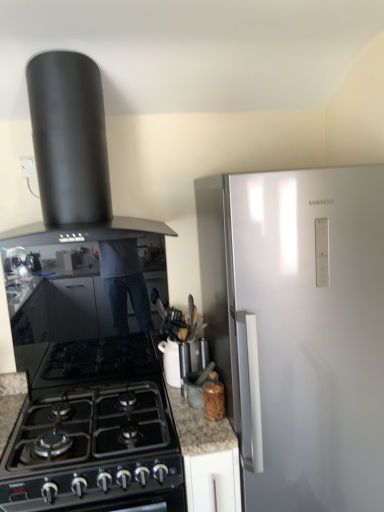
Question: From the image's perspective, is black matte chimney hood at upper left, arranged as the 1th kitchen appliance when viewed from the top, located beneath white glossy teapot at center, which ranks as the 2th kitchen appliance in left-to-right order?

Choices:
 (A) no
 (B) yes

Answer: (A)

Question: From a real-world perspective, does black matte chimney hood at upper left, marked as the 3th kitchen appliance in a bottom-to-top arrangement, stand above white glossy teapot at center, the 2th kitchen appliance in the right-to-left sequence?

Choices:
 (A) yes
 (B) no

Answer: (A)

Question: Is black matte chimney hood at upper left, marked as the 3th kitchen appliance in a right-to-left arrangement, next to white glossy teapot at center, arranged as the second kitchen appliance when ordered from the bottom, and touching it?

Choices:
 (A) yes
 (B) no

Answer: (B)

Question: Does black matte chimney hood at upper left, marked as the 3th kitchen appliance in a bottom-to-top arrangement, have a greater width compared to white glossy teapot at center, the 2th kitchen appliance in the right-to-left sequence?

Choices:
 (A) yes
 (B) no

Answer: (A)

Question: Is black matte chimney hood at upper left, marked as the 3th kitchen appliance in a right-to-left arrangement, outside of white glossy teapot at center, arranged as the second kitchen appliance when ordered from the bottom?

Choices:
 (A) no
 (B) yes

Answer: (B)

Question: Is black matte chimney hood at upper left, positioned as the first kitchen appliance in left-to-right order, facing towards white glossy teapot at center, the 2th kitchen appliance in the right-to-left sequence?

Choices:
 (A) no
 (B) yes

Answer: (A)

Question: Is black glass gas stove at lower left further to camera compared to black matte chimney hood at upper left, arranged as the 1th kitchen appliance when viewed from the top?

Choices:
 (A) yes
 (B) no

Answer: (B)

Question: Can you confirm if black glass gas stove at lower left is wider than black matte chimney hood at upper left, marked as the 3th kitchen appliance in a right-to-left arrangement?

Choices:
 (A) yes
 (B) no

Answer: (A)

Question: Is black glass gas stove at lower left turned away from black matte chimney hood at upper left, positioned as the first kitchen appliance in left-to-right order?

Choices:
 (A) yes
 (B) no

Answer: (B)

Question: From the image's perspective, is black glass gas stove at lower left on black matte chimney hood at upper left, marked as the 3th kitchen appliance in a right-to-left arrangement?

Choices:
 (A) no
 (B) yes

Answer: (A)

Question: Considering the relative positions of black glass gas stove at lower left and black matte chimney hood at upper left, positioned as the first kitchen appliance in left-to-right order, in the image provided, is black glass gas stove at lower left to the left of black matte chimney hood at upper left, positioned as the first kitchen appliance in left-to-right order, from the viewer's perspective?

Choices:
 (A) yes
 (B) no

Answer: (B)

Question: Considering the relative sizes of black glass gas stove at lower left and black matte chimney hood at upper left, positioned as the first kitchen appliance in left-to-right order, in the image provided, is black glass gas stove at lower left thinner than black matte chimney hood at upper left, positioned as the first kitchen appliance in left-to-right order,?

Choices:
 (A) yes
 (B) no

Answer: (B)

Question: Is there a large distance between white glossy teapot at center, the 2th kitchen appliance in the right-to-left sequence, and brown glass bottle at lower center, the first kitchen appliance positioned from the bottom?

Choices:
 (A) yes
 (B) no

Answer: (B)